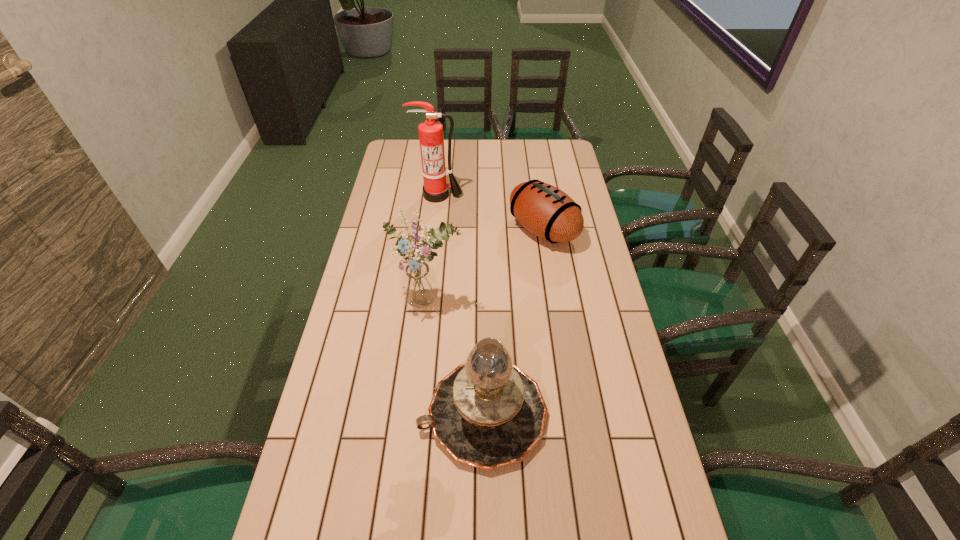
Locate an element on the screen. fire extinguisher that is positioned at the left edge is located at coordinates (431, 138).

The image size is (960, 540). What are the coordinates of `bouquet positioned at the left edge` in the screenshot? It's located at (418, 282).

The width and height of the screenshot is (960, 540). In order to click on object at the right edge in this screenshot , I will do `click(546, 211)`.

Find the location of a particular element. vacant space at the far edge of the desktop is located at coordinates (521, 148).

In the image, there is a desktop. At what (x,y) coordinates should I click in order to perform the action: click on vacant space at the left edge. Please return your answer as a coordinate pair (x, y). Looking at the image, I should click on point(389,295).

The height and width of the screenshot is (540, 960). In order to click on vacant space at the right edge of the desktop in this screenshot , I will do `click(588, 288)`.

The width and height of the screenshot is (960, 540). In order to click on blank space at the far left corner in this screenshot , I will do `click(408, 140)`.

The image size is (960, 540). Identify the location of free space between the fire extinguisher and the oil lamp. (461, 305).

Where is `vacant region between the football (American) and the oil lamp`? vacant region between the football (American) and the oil lamp is located at coordinates (513, 322).

Locate an element on the screen. vacant region between the football (American) and the fire extinguisher is located at coordinates (491, 212).